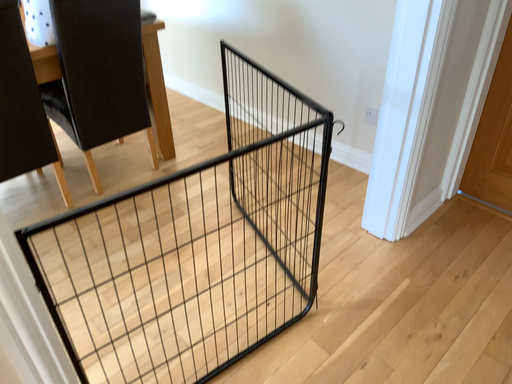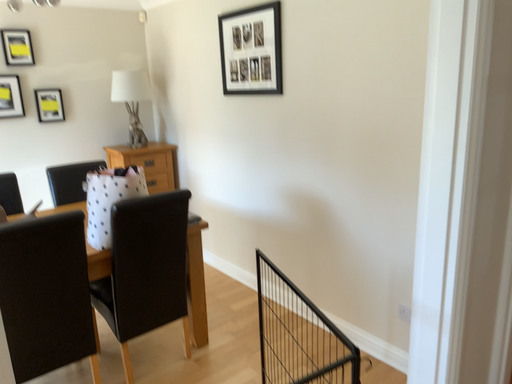
Question: How did the camera likely rotate when shooting the video?

Choices:
 (A) rotated downward
 (B) rotated upward

Answer: (B)